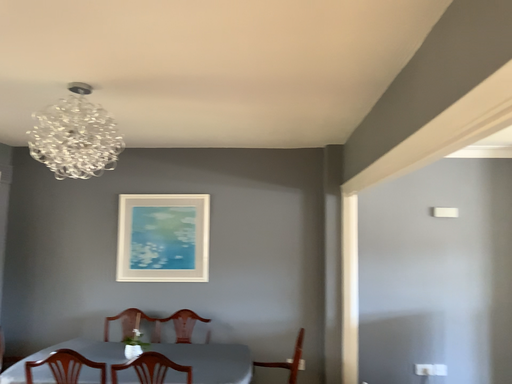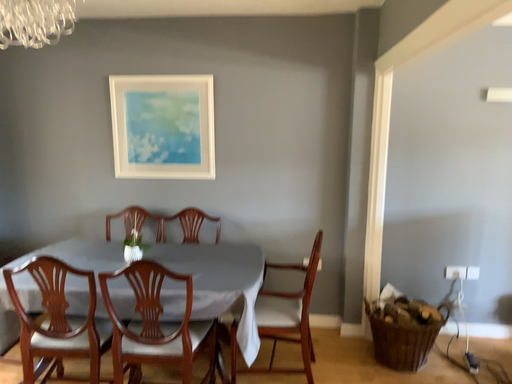
Question: Which way did the camera rotate in the video?

Choices:
 (A) rotated upward
 (B) rotated downward

Answer: (B)